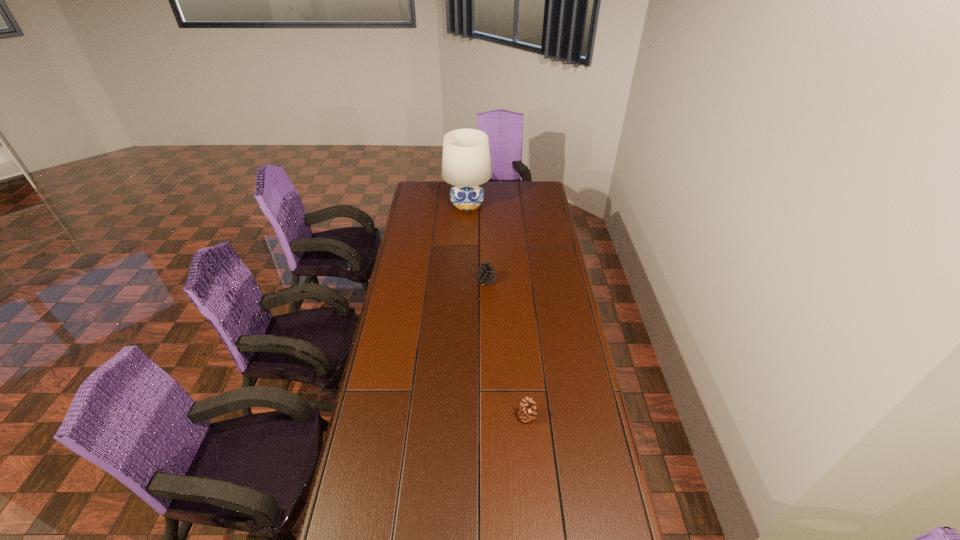
Find the location of a particular element. The height and width of the screenshot is (540, 960). the tallest object is located at coordinates (466, 164).

Image resolution: width=960 pixels, height=540 pixels. Identify the location of lampshade. (466, 164).

At what (x,y) coordinates should I click in order to perform the action: click on the farther pinecone. Please return your answer as a coordinate pair (x, y). Looking at the image, I should click on (486, 275).

At what (x,y) coordinates should I click in order to perform the action: click on the second nearest object. Please return your answer as a coordinate pair (x, y). Image resolution: width=960 pixels, height=540 pixels. Looking at the image, I should click on (486, 275).

Find the location of a particular element. Image resolution: width=960 pixels, height=540 pixels. the rightmost object is located at coordinates (526, 412).

The width and height of the screenshot is (960, 540). Find the location of `the nearer pinecone`. the nearer pinecone is located at coordinates (526, 412).

Where is `free space located 0.190m on the front-facing side of the lampshade`? The width and height of the screenshot is (960, 540). free space located 0.190m on the front-facing side of the lampshade is located at coordinates (466, 240).

What are the coordinates of `vacant area situated on the back of the farther pinecone` in the screenshot? It's located at (486, 244).

Find the location of `vacant region located on the front of the nearer pinecone`. vacant region located on the front of the nearer pinecone is located at coordinates (534, 492).

This screenshot has width=960, height=540. Identify the location of object that is positioned at the far edge. (466, 164).